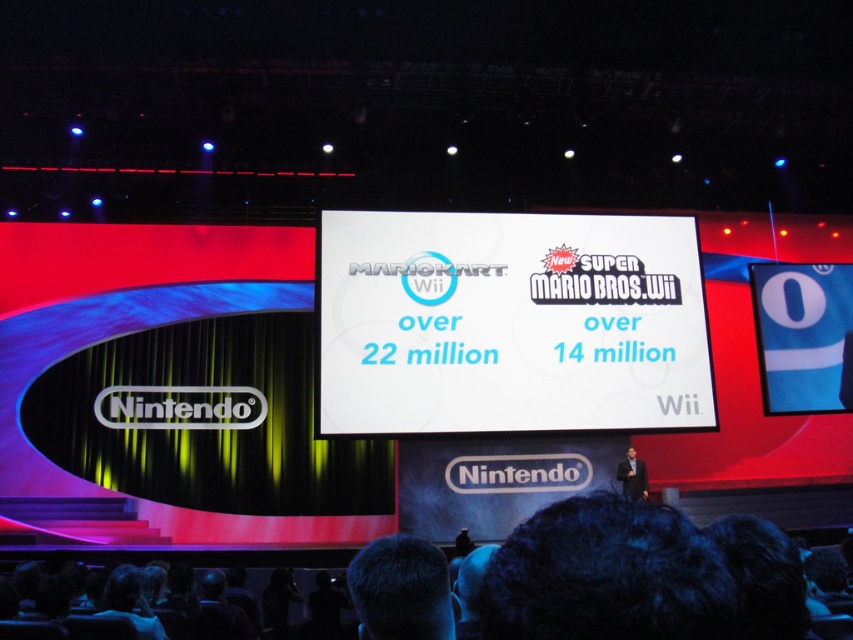
Is blue fabric at center bigger than dark suit at lower right?

Indeed, blue fabric at center has a larger size compared to dark suit at lower right.

Is blue fabric at center to the left of dark suit at lower right from the viewer's perspective?

No, blue fabric at center is not to the left of dark suit at lower right.

Between point (821, 353) and point (624, 461), which one is positioned behind?

Positioned behind is point (821, 353).

In order to click on blue fabric at center in this screenshot , I will do `click(804, 337)`.

From the picture: Is white glossy projection screen at center above blue fabric at center?

Correct, white glossy projection screen at center is located above blue fabric at center.

Is point (409, 320) less distant than point (839, 349)?

Yes.

Which is in front, point (642, 252) or point (828, 369)?

Positioned in front is point (642, 252).

What are the coordinates of `white glossy projection screen at center` in the screenshot? It's located at (509, 323).

The height and width of the screenshot is (640, 853). I want to click on white glossy projection screen at center, so click(x=509, y=323).

Is point (521, 420) positioned after point (642, 483)?

No.

Identify the location of white glossy projection screen at center. The width and height of the screenshot is (853, 640). coord(509,323).